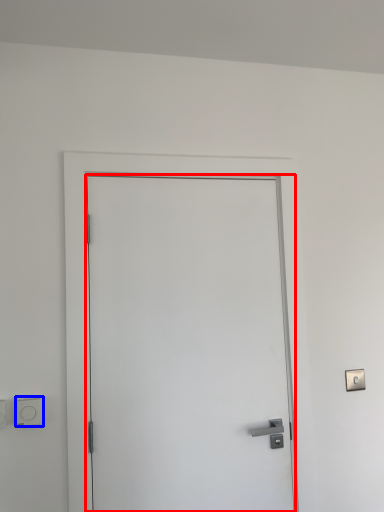
Question: Which of the following is the closest to the observer, door (highlighted by a red box) or light switch (highlighted by a blue box)?

Choices:
 (A) door
 (B) light switch

Answer: (A)